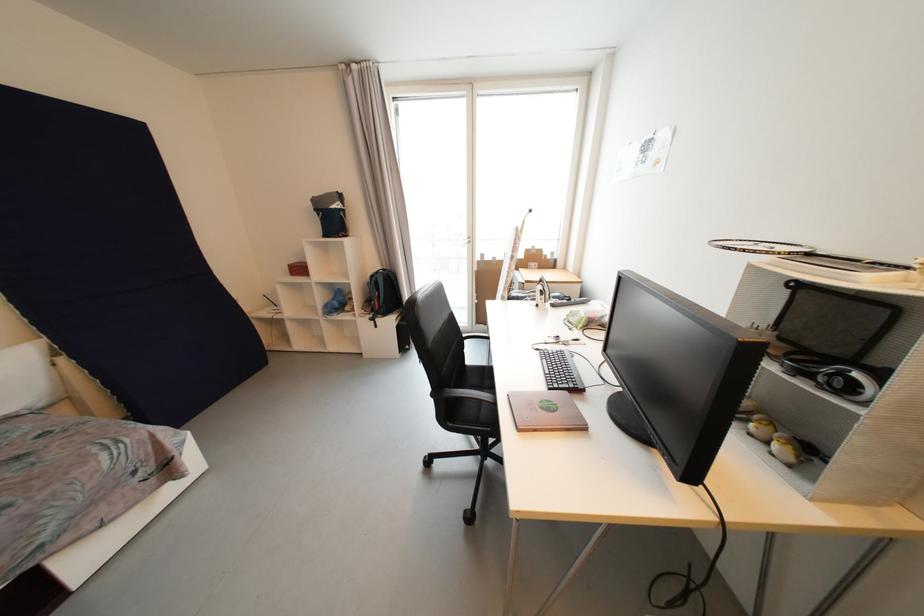
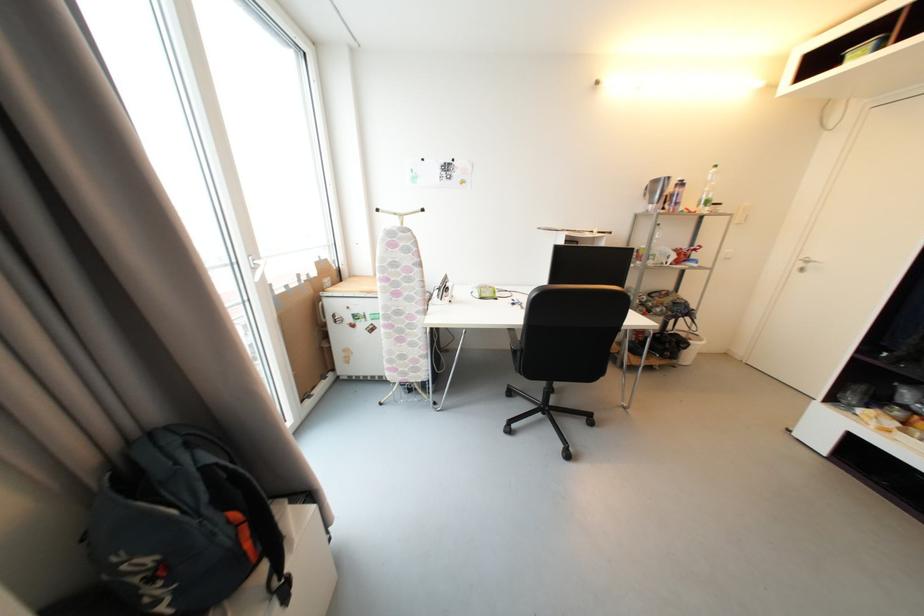
In the second image, find the point that corresponds to (x=382, y=305) in the first image.

(253, 546)